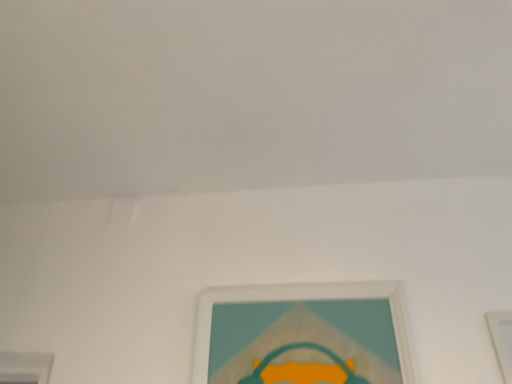
Question: Which direction should I rotate to look at white matte picture frame at center, marked as the second picture frame in a right-to-left arrangement?

Choices:
 (A) right
 (B) left

Answer: (A)

Question: Can you confirm if white matte picture frame at lower right, the 2th picture frame when ordered from left to right, is shorter than white matte picture frame at center, marked as the second picture frame in a right-to-left arrangement?

Choices:
 (A) yes
 (B) no

Answer: (B)

Question: Is white matte picture frame at lower right, arranged as the 1th picture frame when viewed from the right, far from white matte picture frame at center, the first picture frame when ordered from left to right?

Choices:
 (A) yes
 (B) no

Answer: (B)

Question: From the image's perspective, does white matte picture frame at lower right, the 2th picture frame when ordered from left to right, appear lower than white matte picture frame at center, marked as the second picture frame in a right-to-left arrangement?

Choices:
 (A) yes
 (B) no

Answer: (A)

Question: Would you say white matte picture frame at lower right, the 2th picture frame when ordered from left to right, contains white matte picture frame at center, marked as the second picture frame in a right-to-left arrangement?

Choices:
 (A) yes
 (B) no

Answer: (B)

Question: Does white matte picture frame at lower right, arranged as the 1th picture frame when viewed from the right, have a smaller size compared to white matte picture frame at center, the first picture frame when ordered from left to right?

Choices:
 (A) no
 (B) yes

Answer: (B)

Question: Is white matte picture frame at lower right, the 2th picture frame when ordered from left to right, bigger than white matte picture frame at center, the first picture frame when ordered from left to right?

Choices:
 (A) yes
 (B) no

Answer: (B)

Question: Is white matte picture frame at center, the first picture frame when ordered from left to right, further to the viewer compared to white matte picture frame at lower right, arranged as the 1th picture frame when viewed from the right?

Choices:
 (A) yes
 (B) no

Answer: (A)

Question: Is the position of white matte picture frame at center, the first picture frame when ordered from left to right, less distant than that of white matte picture frame at lower right, the 2th picture frame when ordered from left to right?

Choices:
 (A) yes
 (B) no

Answer: (B)

Question: Can you confirm if white matte picture frame at center, the first picture frame when ordered from left to right, is thinner than white matte picture frame at lower right, arranged as the 1th picture frame when viewed from the right?

Choices:
 (A) yes
 (B) no

Answer: (B)

Question: Considering the relative sizes of white matte picture frame at center, the first picture frame when ordered from left to right, and white matte picture frame at lower right, the 2th picture frame when ordered from left to right, in the image provided, is white matte picture frame at center, the first picture frame when ordered from left to right, wider than white matte picture frame at lower right, the 2th picture frame when ordered from left to right,?

Choices:
 (A) yes
 (B) no

Answer: (A)

Question: Is white matte picture frame at center, marked as the second picture frame in a right-to-left arrangement, facing away from white matte picture frame at lower right, arranged as the 1th picture frame when viewed from the right?

Choices:
 (A) yes
 (B) no

Answer: (B)

Question: Can you confirm if white matte picture frame at center, marked as the second picture frame in a right-to-left arrangement, is shorter than white matte picture frame at lower right, arranged as the 1th picture frame when viewed from the right?

Choices:
 (A) yes
 (B) no

Answer: (A)

Question: From a real-world perspective, is white matte picture frame at lower right, arranged as the 1th picture frame when viewed from the right, above or below white matte picture frame at center, marked as the second picture frame in a right-to-left arrangement?

Choices:
 (A) below
 (B) above

Answer: (A)